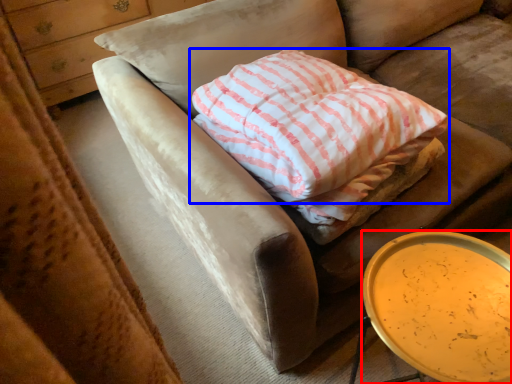
Question: Which object appears farthest to the camera in this image, table (highlighted by a red box) or pillow (highlighted by a blue box)?

Choices:
 (A) table
 (B) pillow

Answer: (B)